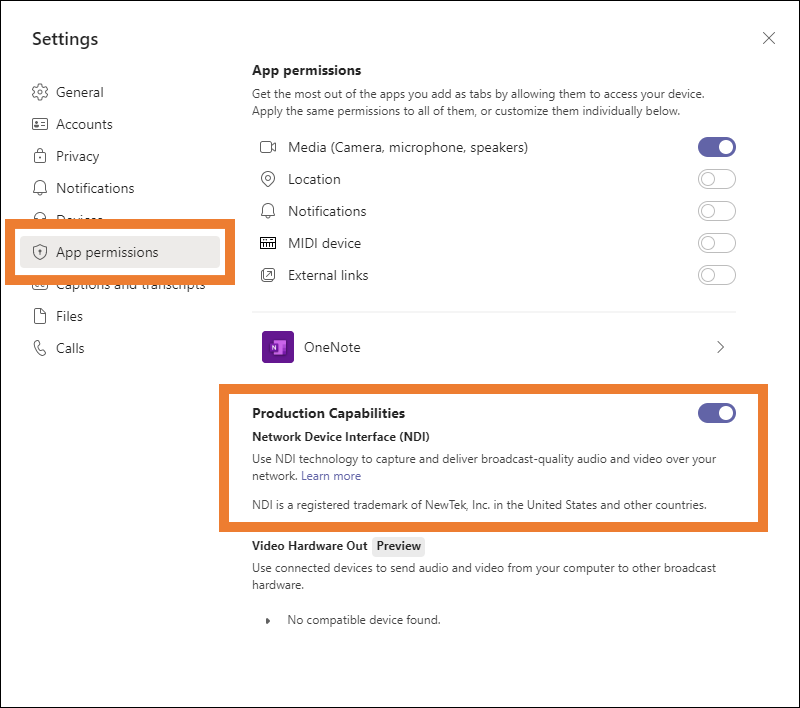
Identify the location of phone. (40, 350).